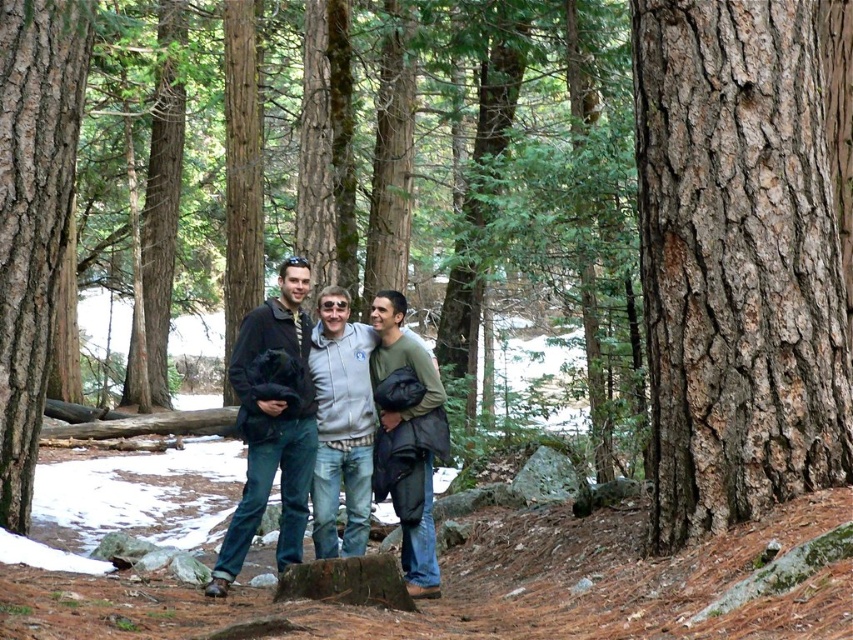
Question: Is gray fleece jacket at center bigger than green matte jacket at center?

Choices:
 (A) no
 (B) yes

Answer: (B)

Question: Considering the real-world distances, which object is closest to the gray fleece jacket at center?

Choices:
 (A) smooth brown bark at center
 (B) green matte jacket at center
 (C) matte black jacket at center
 (D) smooth brown bark at left

Answer: (B)

Question: Which point is farther from the camera taking this photo?

Choices:
 (A) (61, 202)
 (B) (796, 77)

Answer: (A)

Question: Which is nearer to the smooth brown bark at left?

Choices:
 (A) matte black jacket at center
 (B) smooth brown bark at center
 (C) green matte jacket at center

Answer: (A)

Question: Can you confirm if smooth brown bark at left is wider than gray fleece jacket at center?

Choices:
 (A) no
 (B) yes

Answer: (B)

Question: Can you confirm if matte black jacket at center is positioned below green matte jacket at center?

Choices:
 (A) no
 (B) yes

Answer: (B)